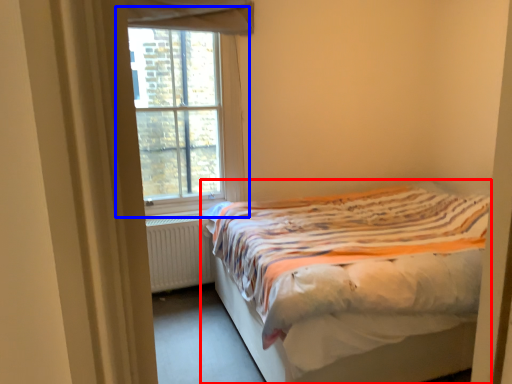
Question: Which object appears closest to the camera in this image, bed (highlighted by a red box) or window (highlighted by a blue box)?

Choices:
 (A) bed
 (B) window

Answer: (A)